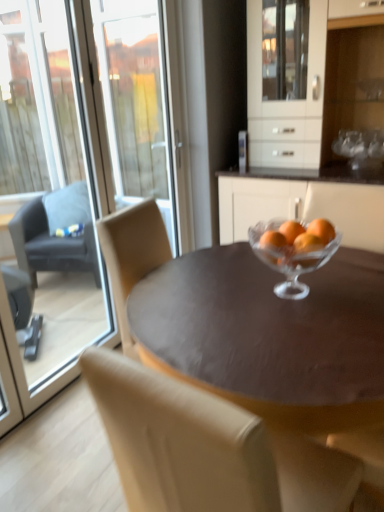
Where is `free point in front of clear glass bowl at center`? Image resolution: width=384 pixels, height=512 pixels. free point in front of clear glass bowl at center is located at coordinates (312, 327).